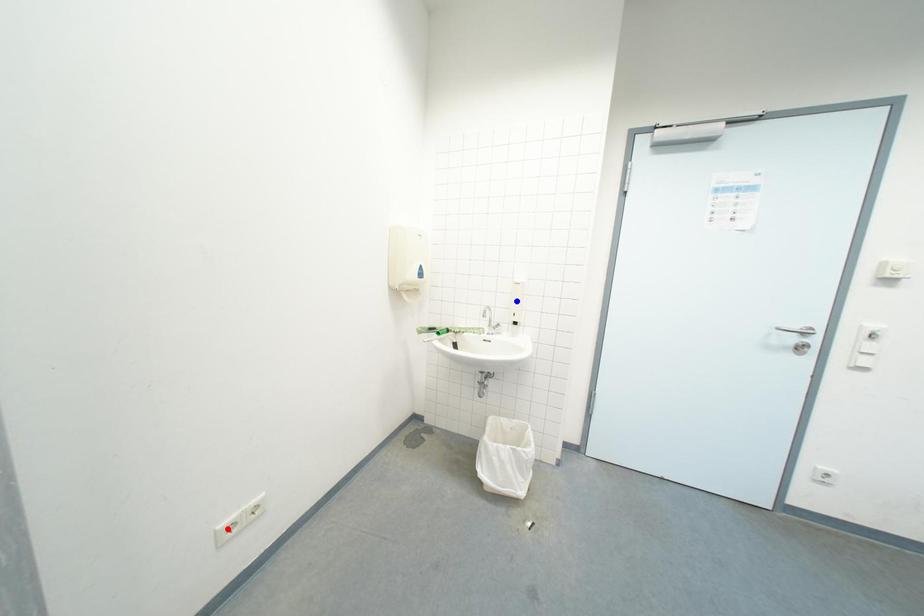
Question: Which of the two points in the image is closer to the camera?

Choices:
 (A) Blue point is closer.
 (B) Red point is closer.

Answer: (B)